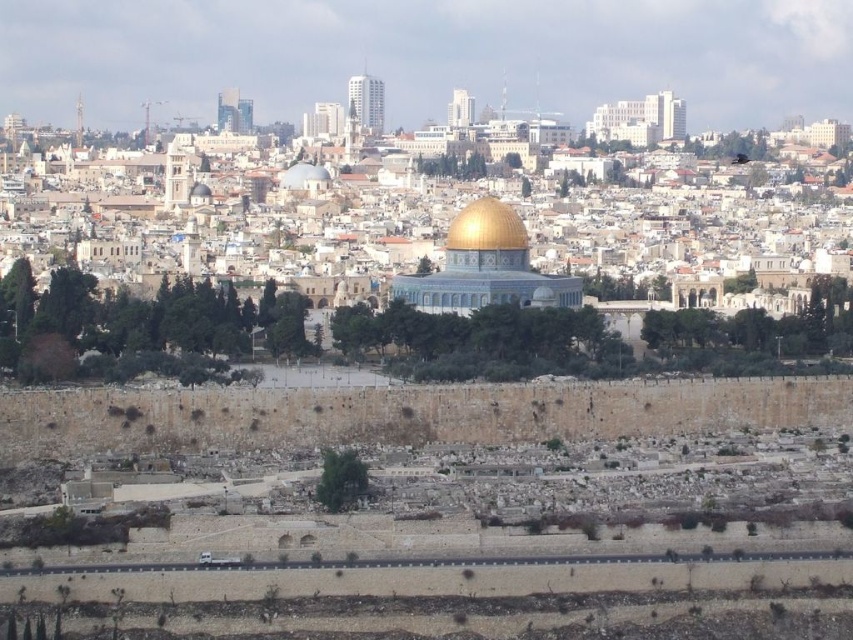
Question: Is gold shiny dome at center positioned at the back of white marble dome at center?

Choices:
 (A) no
 (B) yes

Answer: (A)

Question: Can you confirm if gold shiny dome at center is positioned to the right of white marble dome at center?

Choices:
 (A) yes
 (B) no

Answer: (A)

Question: Which point appears closest to the camera in this image?

Choices:
 (A) (280, 186)
 (B) (480, 218)

Answer: (B)

Question: Does gold shiny dome at center have a larger size compared to white marble dome at center?

Choices:
 (A) yes
 (B) no

Answer: (A)